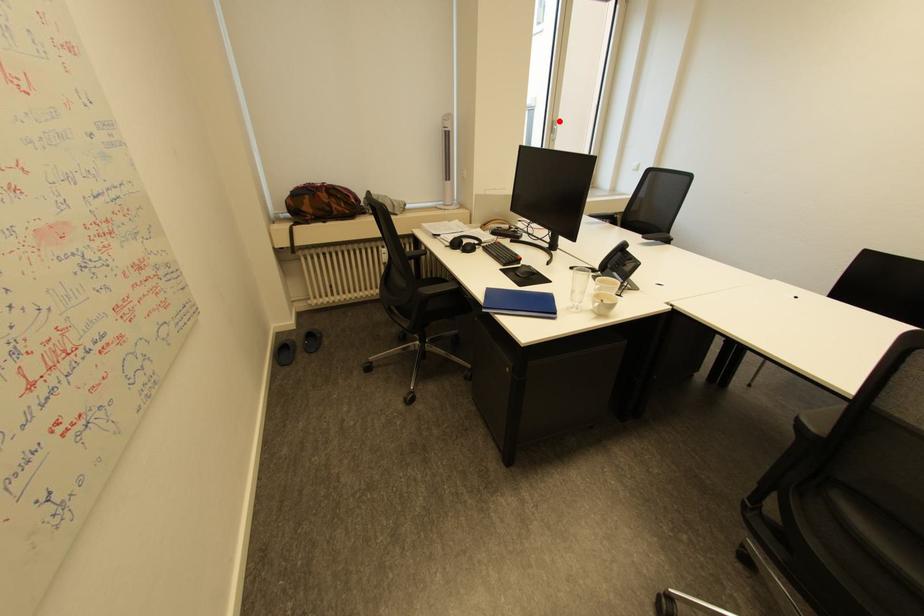
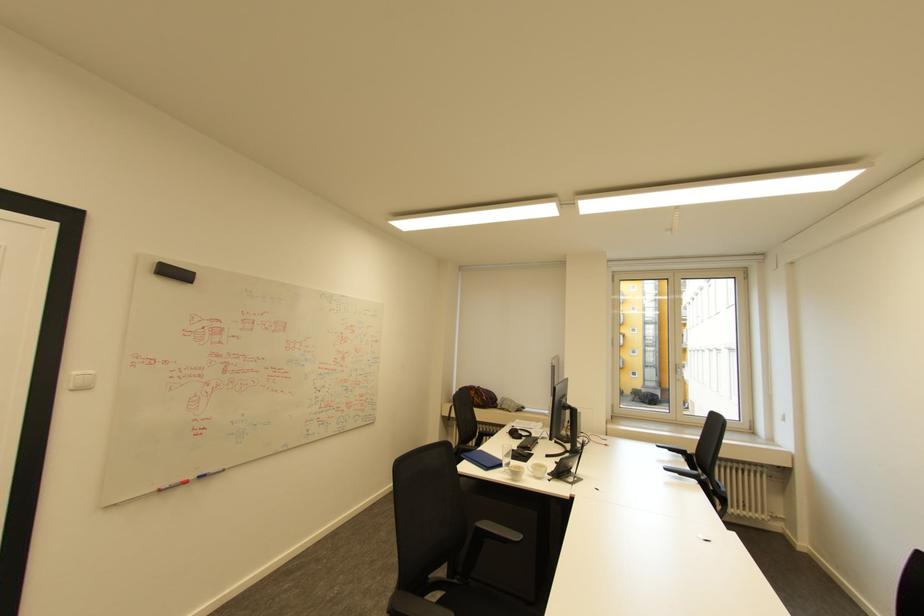
Question: I am providing you with two images of the same scene from different viewpoints. In image1, a red point is highlighted. Considering the same 3D point in image2, which of the following is correct?

Choices:
 (A) It is closer
 (B) It is farther

Answer: (A)